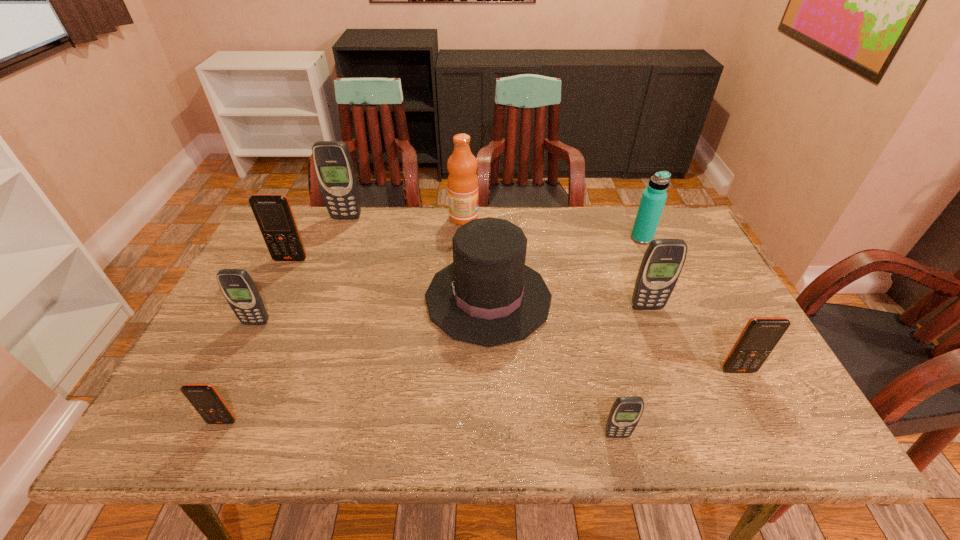
Where is `the fourth nearest cellular telephone`? the fourth nearest cellular telephone is located at coordinates (240, 291).

In order to click on the third biggest gray cellular telephone in this screenshot , I will do (240, 291).

Find the location of a particular element. This screenshot has width=960, height=540. the rightmost orange cellular telephone is located at coordinates (760, 336).

The image size is (960, 540). Find the location of `the eighth farthest object`. the eighth farthest object is located at coordinates (760, 336).

Identify the location of the sixth farthest cellular telephone. (204, 397).

You are a GUI agent. You are given a task and a screenshot of the screen. Output one action in this format:
    pyautogui.click(x=<x>, y=<y>)
    Task: Click on the ninth farthest object
    The image size is (960, 540).
    Given the screenshot: What is the action you would take?
    pyautogui.click(x=204, y=397)

I want to click on the nearest object, so click(626, 411).

Identify the location of the seventh object from left to right. Image resolution: width=960 pixels, height=540 pixels. (626, 411).

This screenshot has height=540, width=960. What are the coordinates of `vacant region located 0.100m on the label side of the fruit juice` in the screenshot? It's located at (509, 218).

At what (x,y) coordinates should I click in order to perform the action: click on vacant space located on the screen of the third gray cellular telephone from right to left. Please return your answer as a coordinate pair (x, y). Image resolution: width=960 pixels, height=540 pixels. Looking at the image, I should click on (325, 273).